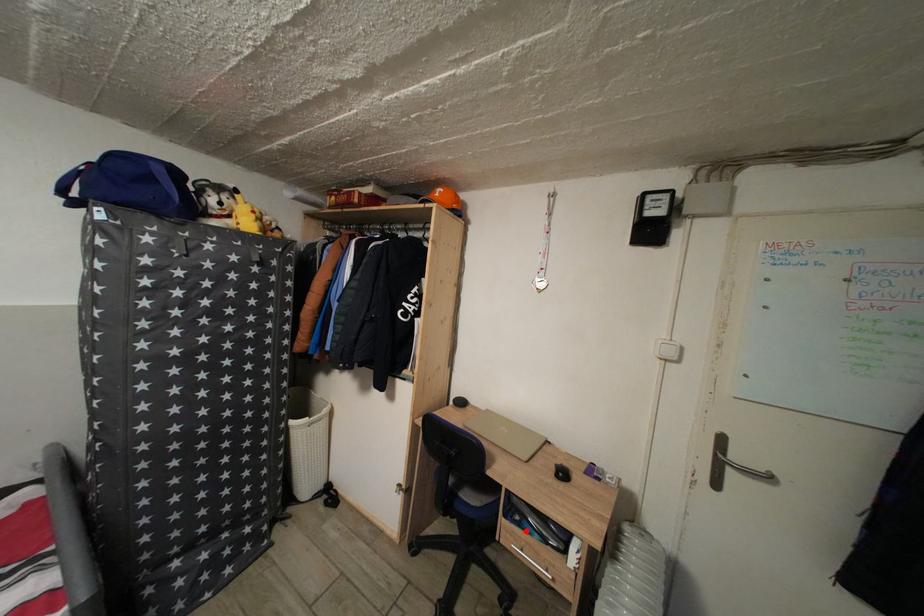
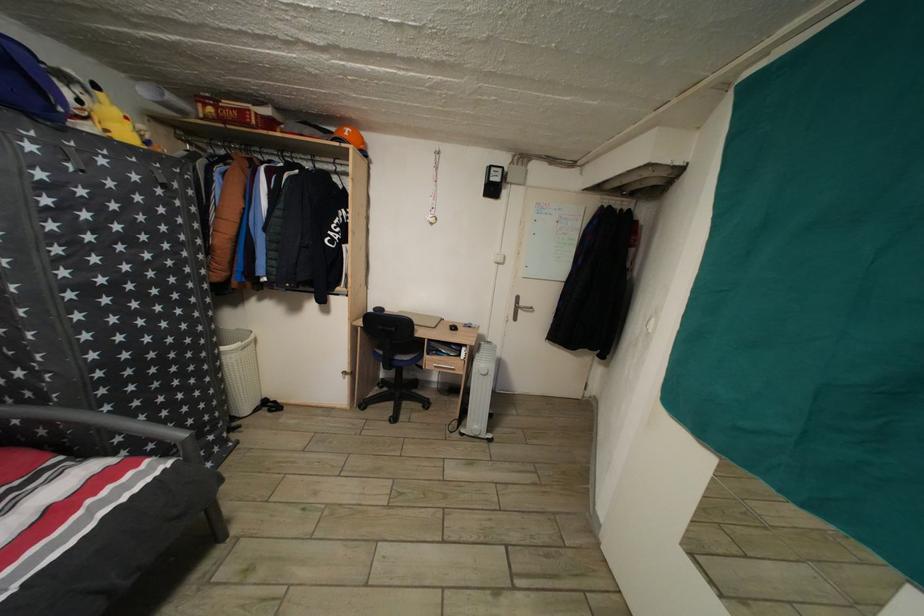
Locate, in the second image, the point that corresponds to the highlighted location in the first image.

(443, 361)